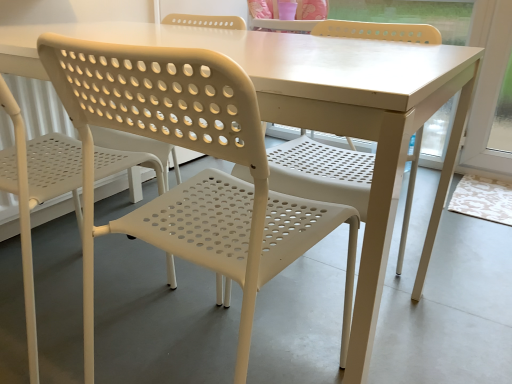
At what (x,y) coordinates should I click in order to perform the action: click on free space behind white plastic chair at center, which appears as the first chair when viewed from the right. Please return your answer as a coordinate pair (x, y). Looking at the image, I should click on (256, 298).